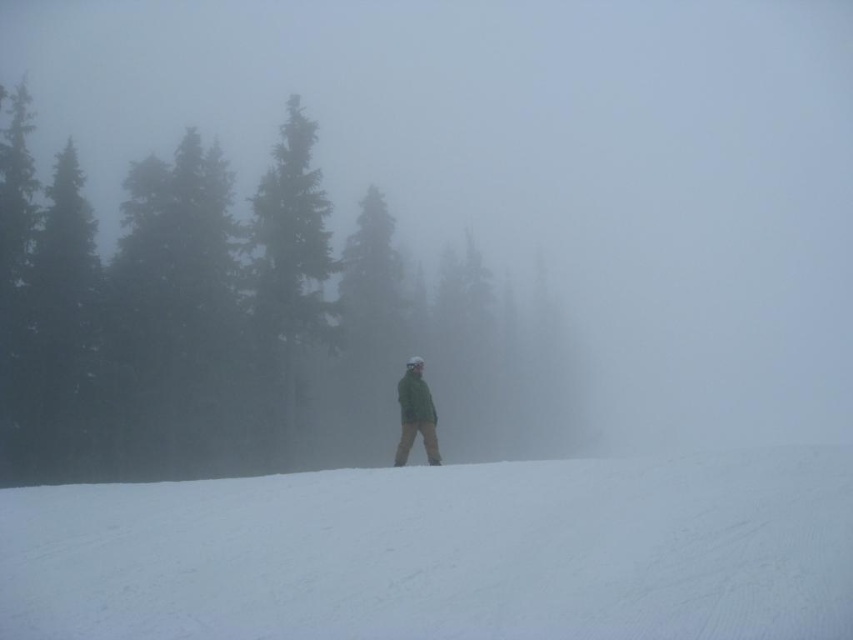
You are standing at the point marked by the coordinates point (248,326) in the snowy landscape. Looking around, you see a dense line of coniferous trees in the background. Can you determine if the point is located on a green matte tree at center?

Yes, the point (248,326) is on the green matte tree at center.

You are standing in the snowy landscape and want to take a photo of the green matte tree at center and the white snow at center. Which object will appear larger in the photo?

The green matte tree at center will appear larger in the photo because it is much taller than the white snow at center.

You are standing in the snowy landscape and see the green matte tree at center and the green matte jacket at center. Which object is positioned to the left of the other?

The green matte tree at center is to the left of the green matte jacket at center.